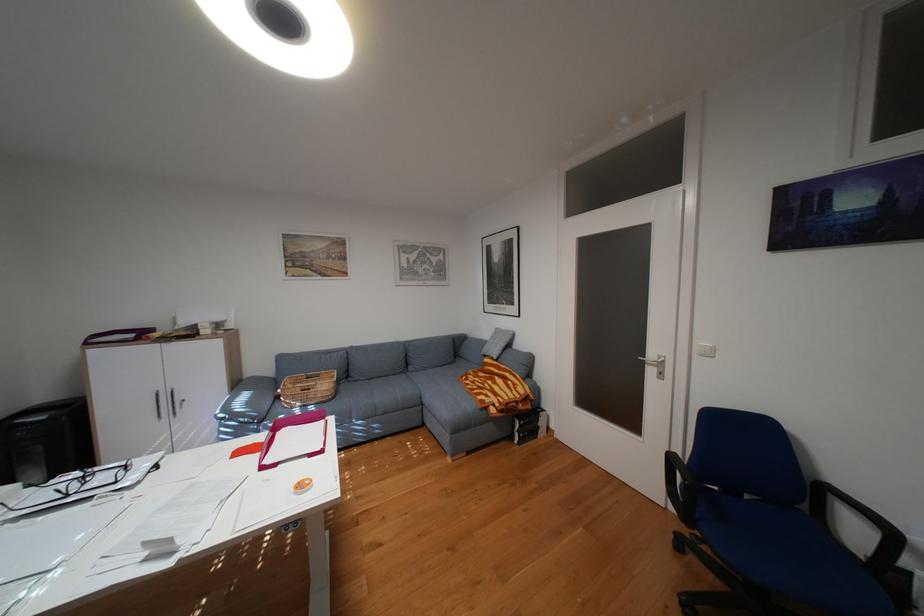
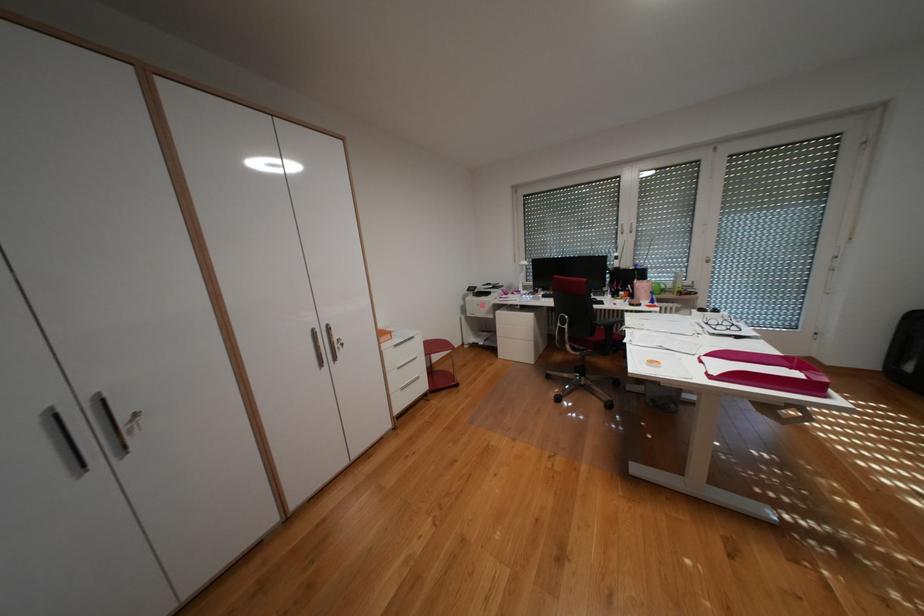
Locate, in the second image, the point that corresponds to point 334,451 in the first image.

(723, 377)